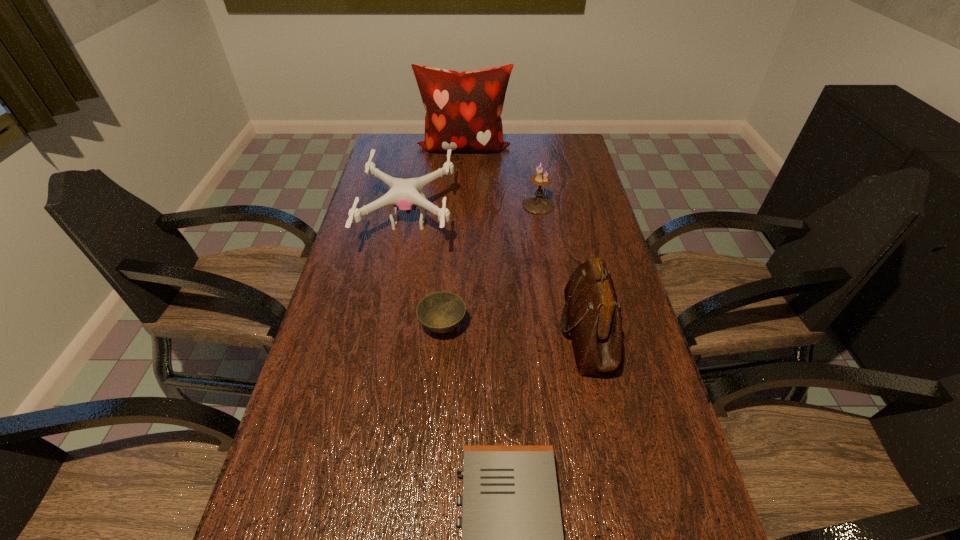
This screenshot has height=540, width=960. I want to click on vacant space positioned on the back of the bowl, so click(x=448, y=257).

Where is `object that is at the far edge`? object that is at the far edge is located at coordinates (463, 109).

Locate an element on the screen. cushion at the left edge is located at coordinates (463, 109).

This screenshot has height=540, width=960. In order to click on drone present at the left edge in this screenshot , I will do `click(404, 194)`.

The height and width of the screenshot is (540, 960). Identify the location of shoulder bag located at the right edge. (593, 314).

Find the location of a particular element. This screenshot has width=960, height=540. candle holder that is at the right edge is located at coordinates (536, 204).

Where is `object situated at the far left corner`? object situated at the far left corner is located at coordinates (463, 109).

Image resolution: width=960 pixels, height=540 pixels. I want to click on vacant space at the left edge, so click(369, 306).

I want to click on vacant region at the right edge of the desktop, so click(x=593, y=197).

Find the location of `vacant area at the far right corner`. vacant area at the far right corner is located at coordinates (571, 140).